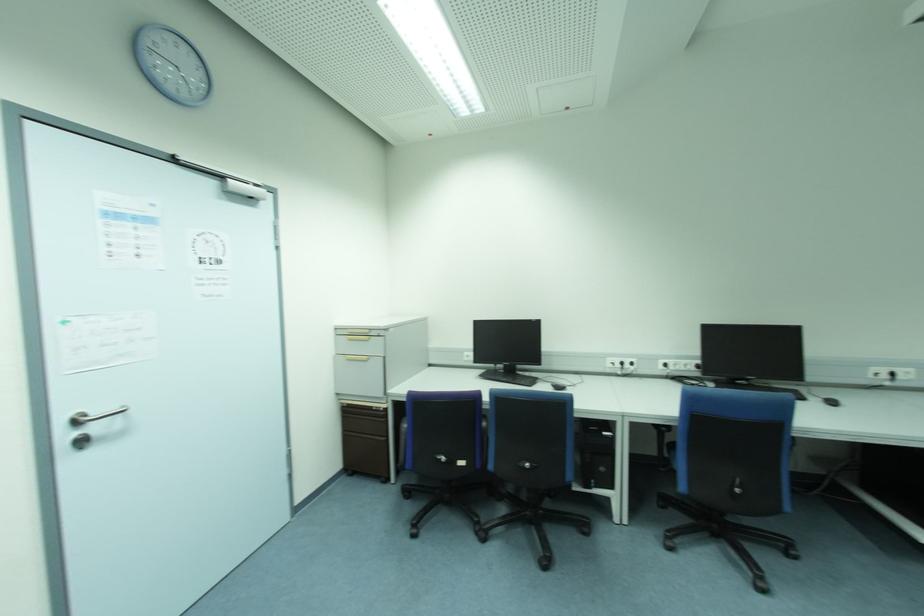
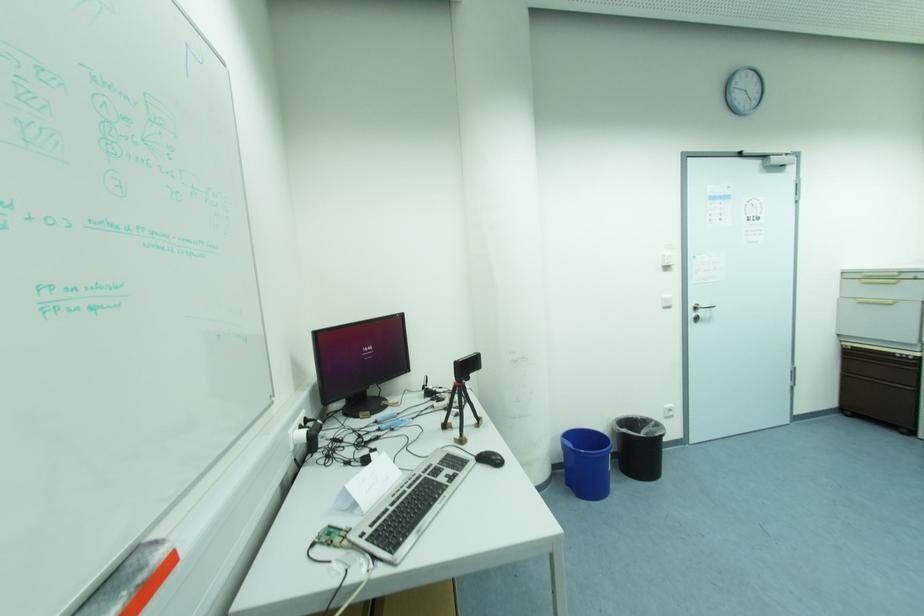
Where in the second image is the point corresponding to the point at 79,421 from the first image?

(697, 309)